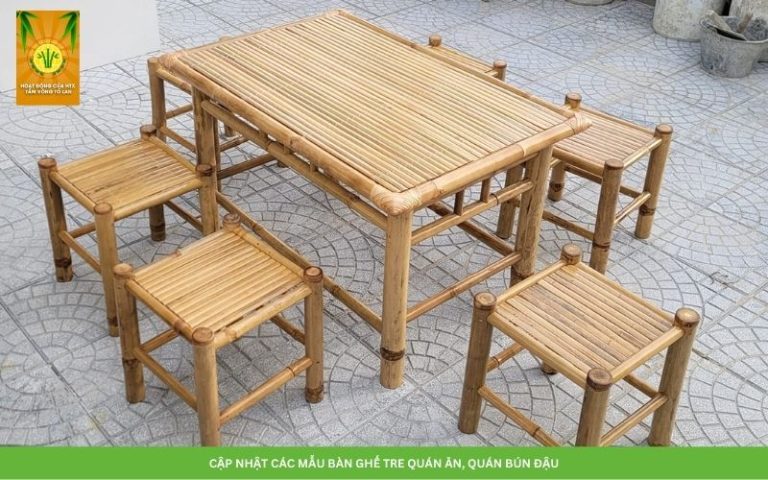
I want to click on right front table leg, so click(531, 214).